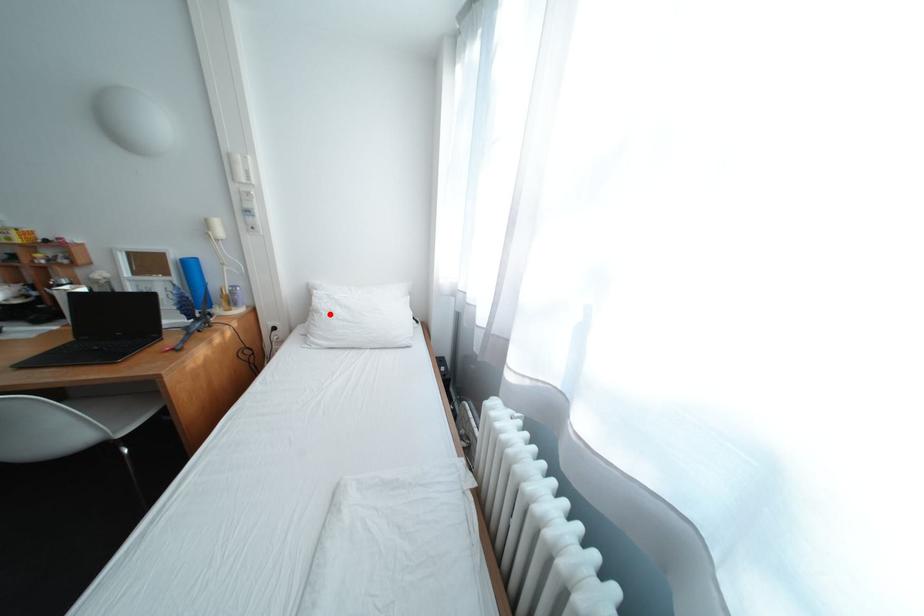
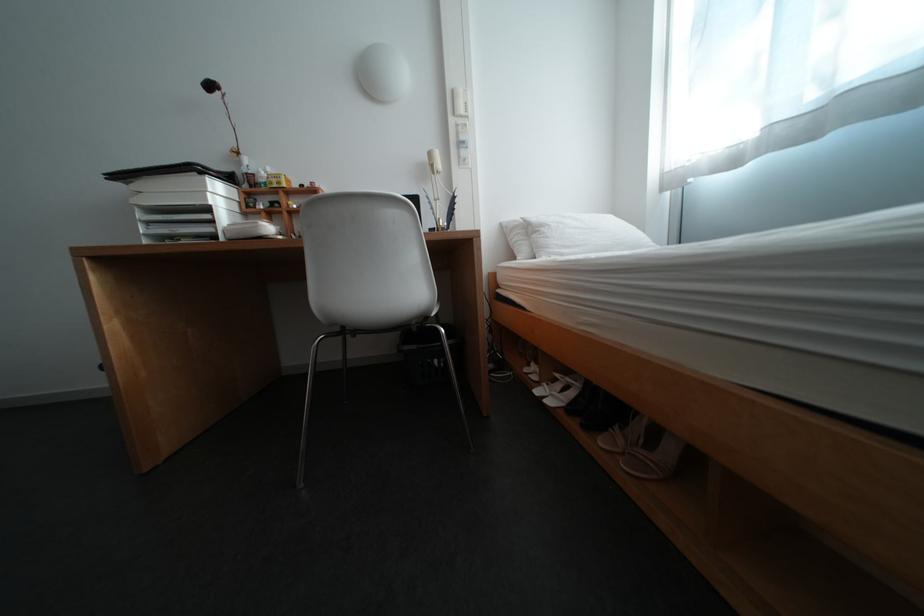
The point at the highlighted location is marked in the first image. Where is the corresponding point in the second image?

(555, 228)